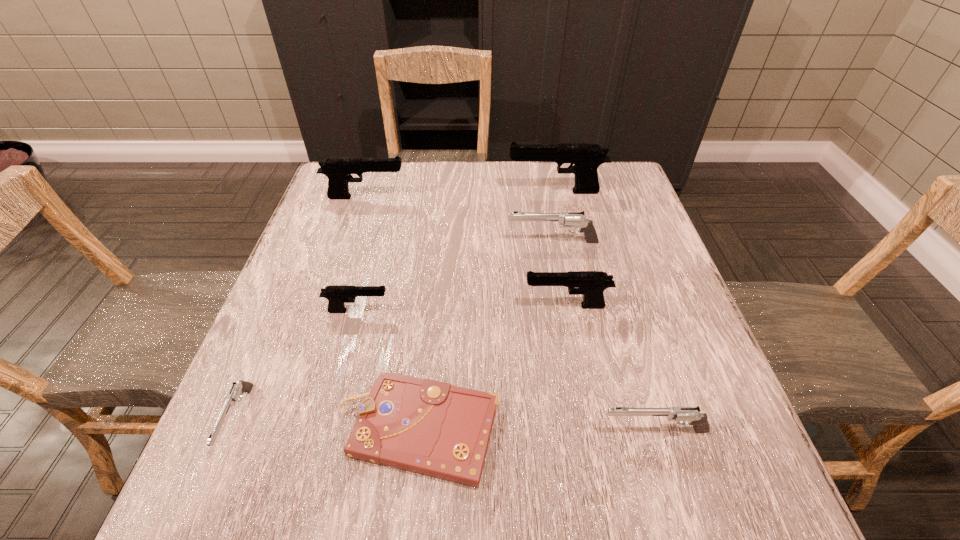
This screenshot has height=540, width=960. Identify the location of the second shortest object. (239, 387).

Identify the location of the shortest object. The width and height of the screenshot is (960, 540). pyautogui.click(x=424, y=426).

You are a GUI agent. You are given a task and a screenshot of the screen. Output one action in this format:
    pyautogui.click(x=<x>, y=<y>)
    Task: Click on the notebook
    The width and height of the screenshot is (960, 540).
    Given the screenshot: What is the action you would take?
    pyautogui.click(x=424, y=426)

At what (x,y) coordinates should I click in order to perform the action: click on vacant space situated 0.210m on the front-facing side of the tallest pistol. Please return your answer as a coordinate pair (x, y). Looking at the image, I should click on (432, 192).

You are a GUI agent. You are given a task and a screenshot of the screen. Output one action in this format:
    pyautogui.click(x=<x>, y=<y>)
    Task: Click on the free space located on the front-facing side of the tallest pistol
    
    Given the screenshot: What is the action you would take?
    pyautogui.click(x=365, y=192)

Where is `vacant space located on the front-facing side of the tallest pistol`? This screenshot has height=540, width=960. vacant space located on the front-facing side of the tallest pistol is located at coordinates (490, 192).

Where is `free region located on the front-facing side of the second biggest black pistol`? free region located on the front-facing side of the second biggest black pistol is located at coordinates (496, 197).

The image size is (960, 540). I want to click on free space located 0.270m on the front-facing side of the third biggest black pistol, so 396,306.

The width and height of the screenshot is (960, 540). I want to click on free region located on the front-facing side of the third biggest black pistol, so click(500, 306).

Locate an element on the screen. This screenshot has height=540, width=960. free spot located 0.400m on the front-facing side of the third biggest black pistol is located at coordinates (335, 306).